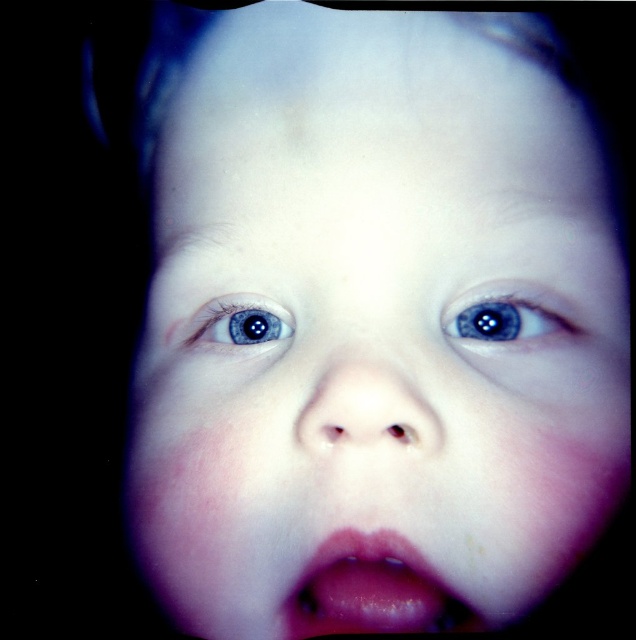
Is pink glossy lips at center taller than blue glossy eye at upper left?

Yes, pink glossy lips at center is taller than blue glossy eye at upper left.

Is point (286, 620) positioned before point (291, 321)?

Yes, point (286, 620) is in front of point (291, 321).

Who is more distant from viewer, (x=349, y=557) or (x=289, y=330)?

Positioned behind is point (x=289, y=330).

Identify the location of pink glossy lips at center. (371, 589).

Based on the photo, can you confirm if pink glossy lips at center is taller than blue glossy eye at center?

Yes.

Which is below, pink glossy lips at center or blue glossy eye at center?

pink glossy lips at center is lower down.

Between point (403, 588) and point (574, 321), which one is positioned in front?

Point (403, 588) is more forward.

Locate an element on the screen. pink glossy lips at center is located at coordinates (371, 589).

Does blue glossy eye at center have a greater width compared to blue glossy eye at upper left?

Indeed, blue glossy eye at center has a greater width compared to blue glossy eye at upper left.

Between point (570, 304) and point (256, 321), which one is positioned behind?

Point (256, 321)

Locate an element on the screen. Image resolution: width=636 pixels, height=640 pixels. blue glossy eye at center is located at coordinates (511, 316).